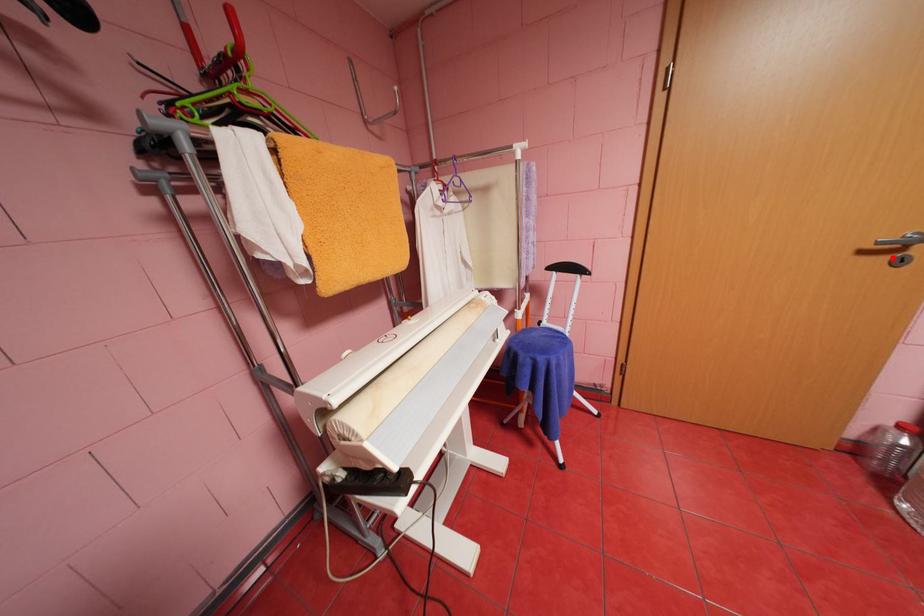
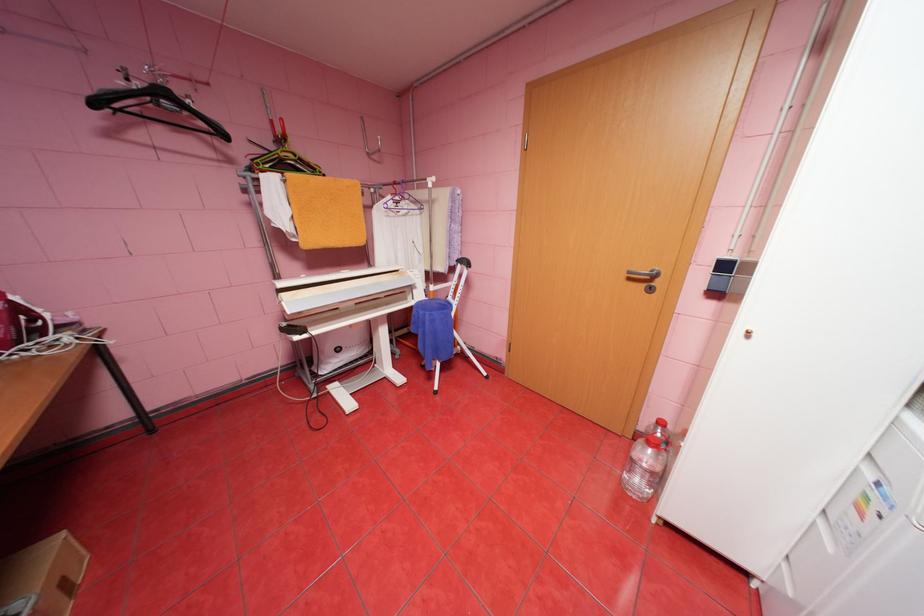
Locate, in the second image, the point that corresponds to the highlighted location in the first image.

(650, 285)